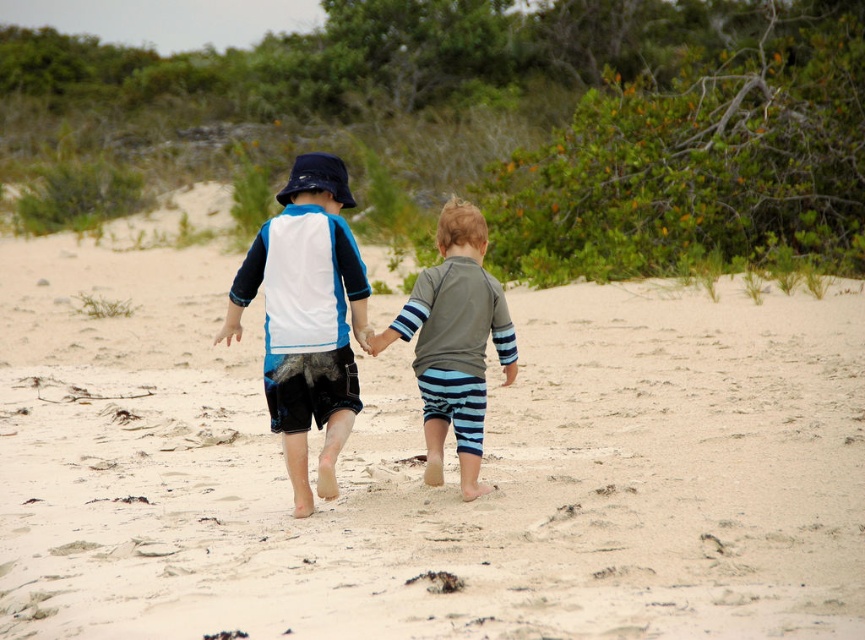
You are a photographer aiming to capture the two children walking on the beach. Based on the scene, which object is closer to the camera between the light beige sand at center and the gray matte rash guard at center?

The light beige sand at center is closer to the camera because it is in front of the gray matte rash guard at center.

You are a photographer standing on the beach. You want to take a photo of the light beige sand at center and the blue striped shorts at center. Which object should you focus on first if you want the one closer to you to be in focus?

The light beige sand at center is in front of the blue striped shorts at center, so you should focus on the light beige sand at center first to ensure it is in focus since it is closer to you.

From the picture: You are a photographer trying to capture the two children walking on the beach. You need to ensure that both the gray matte rash guard at center and the blue striped shorts at center are clearly visible in the photo. Given their sizes, which object should you focus on first to ensure it doesn

The gray matte rash guard at center is bigger than the blue striped shorts at center, so you should focus on the gray matte rash guard at center first to ensure it is clearly visible in the photo.